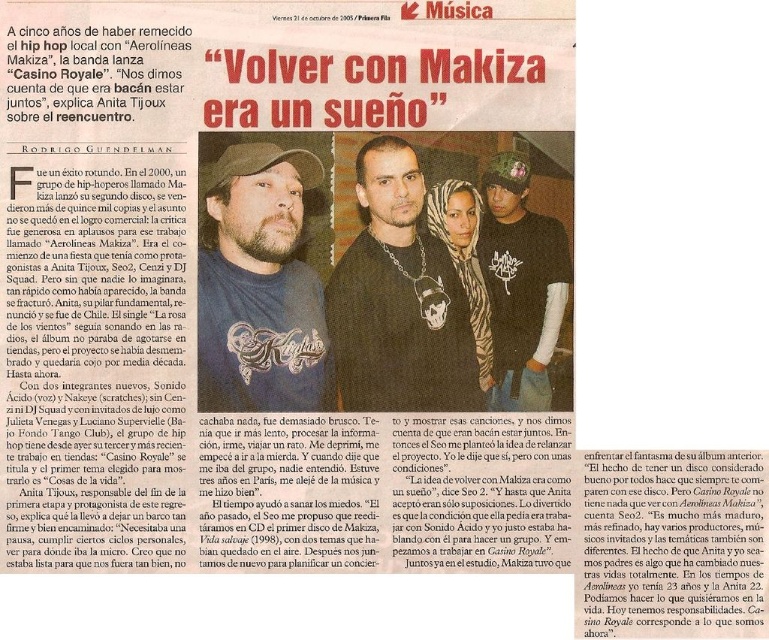
Does point (255, 252) lie in front of point (378, 144)?

No, it is not.

Looking at this image, does matte black t-shirt at center appear under matte black chain at center?

Indeed, matte black t-shirt at center is positioned under matte black chain at center.

Which is behind, point (278, 320) or point (388, 225)?

Point (388, 225)

The height and width of the screenshot is (640, 769). Find the location of `matte black t-shirt at center`. matte black t-shirt at center is located at coordinates (260, 285).

Consider the image. Can you confirm if matte black laptop at center is positioned above matte black t-shirt at center?

No, matte black laptop at center is not above matte black t-shirt at center.

Between matte black laptop at center and matte black t-shirt at center, which one appears on the left side from the viewer's perspective?

From the viewer's perspective, matte black t-shirt at center appears more on the left side.

Between point (453, 531) and point (313, 161), which one is positioned behind?

Positioned behind is point (313, 161).

What are the coordinates of `matte black laptop at center` in the screenshot? It's located at click(265, 292).

Does matte black laptop at center have a larger size compared to matte black chain at center?

Correct, matte black laptop at center is larger in size than matte black chain at center.

Does matte black laptop at center have a lesser height compared to matte black chain at center?

Incorrect, matte black laptop at center's height does not fall short of matte black chain at center's.

Is point (451, 365) closer to viewer compared to point (335, 355)?

Yes, point (451, 365) is closer to viewer.

At what (x,y) coordinates should I click in order to perform the action: click on matte black laptop at center. Please return your answer as a coordinate pair (x, y). Image resolution: width=769 pixels, height=640 pixels. Looking at the image, I should click on (265, 292).